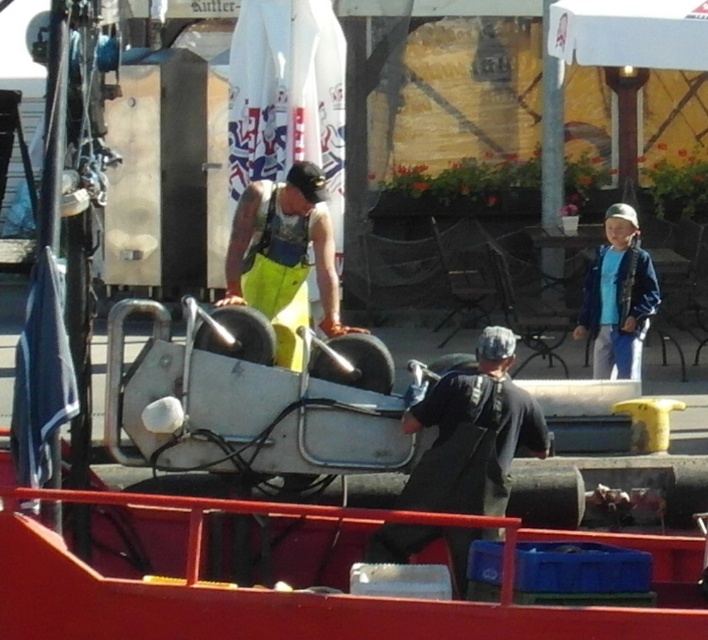
You are a safety inspector observing the scene. You need to determine if the yellow fabric worker at center and the blue denim jacket at right are positioned safely. According to safety protocols, workers must maintain a minimum distance of 2 meters between each other. Can you confirm if they are compliant with this rule based on their heights?

The question asks about the distance between the yellow fabric worker at center and the blue denim jacket at right, but the provided information only states that the yellow fabric worker at center is shorter than the blue denim jacket at right. There is no data about their spatial positioning or distance apart, so compliance with the 2 meter rule cannot be confirmed based on height alone.

You are a safety inspector observing the scene. You need to check the safety gear of the workers. Which worker should you approach first, the yellow fabric worker at center or the blue denim jacket at right?

The yellow fabric worker at center is closer to the viewer than the blue denim jacket at right, so you should approach the yellow fabric worker at center first.